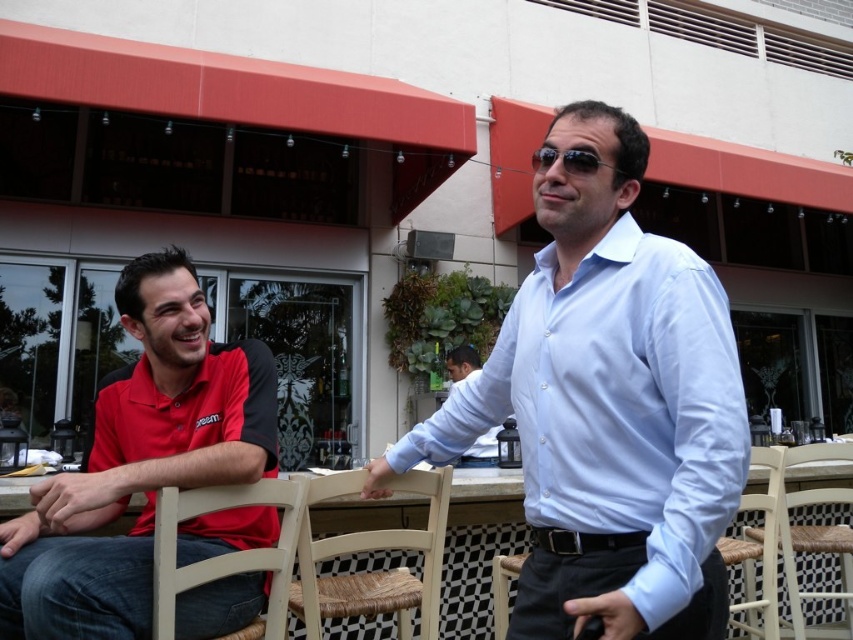
You are sitting in the white wicker chair at lower center and want to get a drink from the table located between the woven wood chair at center and yourself. Can you easily reach the table without moving your chair?

The woven wood chair at center is in front of the white wicker chair at lower center, so the table between them would be positioned behind the woven wood chair at center. This means you would need to move your chair forward to reach the table, making it difficult to do so without adjusting your position.

You are a photographer trying to capture a candid shot of the light blue shirt at center without including the light beige wood chair at lower left in the frame. Based on their positions, is this possible?

The light beige wood chair at lower left is in front of the light blue shirt at center, so it would block the view. Therefore, it is not possible to capture the light blue shirt at center without including the light beige wood chair at lower left in the frame.